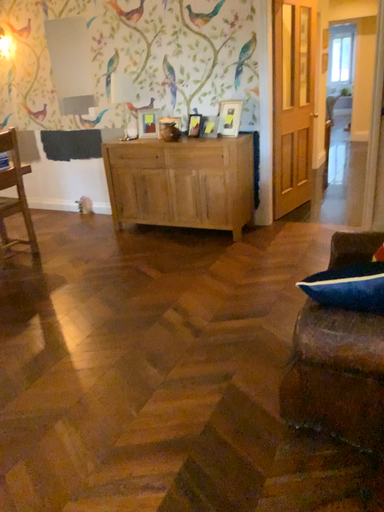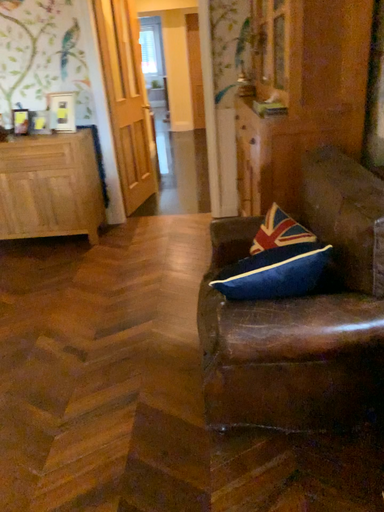
Question: How did the camera likely rotate when shooting the video?

Choices:
 (A) rotated left
 (B) rotated right

Answer: (B)